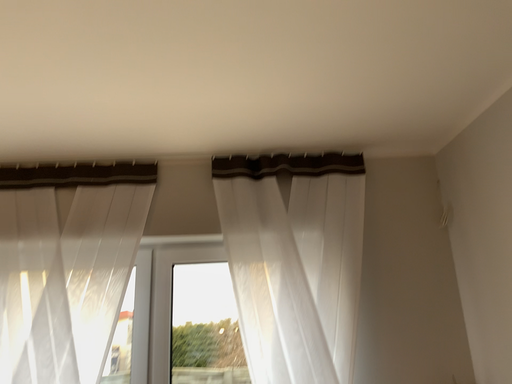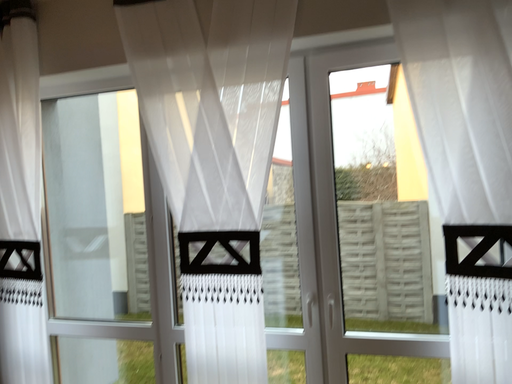
Question: Which way did the camera rotate in the video?

Choices:
 (A) rotated left
 (B) rotated right

Answer: (A)